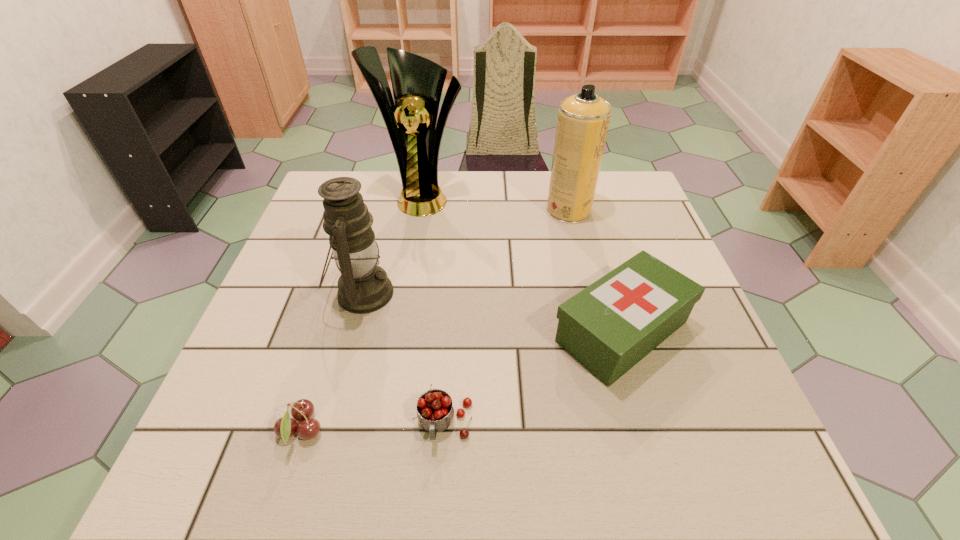
Image resolution: width=960 pixels, height=540 pixels. In order to click on free spot between the award and the oil lamp in this screenshot , I will do `click(393, 245)`.

Locate an element on the screen. This screenshot has height=540, width=960. empty space between the left cherry and the first-aid kit is located at coordinates (462, 381).

Point out which object is positioned as the fourth nearest to the first-aid kit. Please provide its 2D coordinates. Your answer should be formatted as a tuple, i.e. [(x, y)], where the tuple contains the x and y coordinates of a point satisfying the conditions above.

[(363, 287)]

Where is `object that is the fifth closest to the first-aid kit`? This screenshot has width=960, height=540. object that is the fifth closest to the first-aid kit is located at coordinates (285, 427).

Image resolution: width=960 pixels, height=540 pixels. What are the coordinates of `free space that satisfies the following two spatial constraints: 1. on the front side of the aerosol can; 2. on the leaves of the shortest object` in the screenshot? It's located at (622, 430).

At what (x,y) coordinates should I click in order to perform the action: click on vacant position in the image that satisfies the following two spatial constraints: 1. on the handle side of the taller cherry; 2. on the leaves of the shorter cherry. Please return your answer as a coordinate pair (x, y). The image size is (960, 540). Looking at the image, I should click on (444, 430).

You are a GUI agent. You are given a task and a screenshot of the screen. Output one action in this format:
    pyautogui.click(x=<x>, y=<y>)
    Task: Click on the vacant position in the image that satisfies the following two spatial constraints: 1. on the front side of the first-aid kit; 2. on the right side of the third tallest object
    This screenshot has height=540, width=960.
    Given the screenshot: What is the action you would take?
    pyautogui.click(x=352, y=332)

What are the coordinates of `free space that satisfies the following two spatial constraints: 1. at the front of the award, where the globe is visible; 2. on the leaves of the left cherry` in the screenshot? It's located at (383, 430).